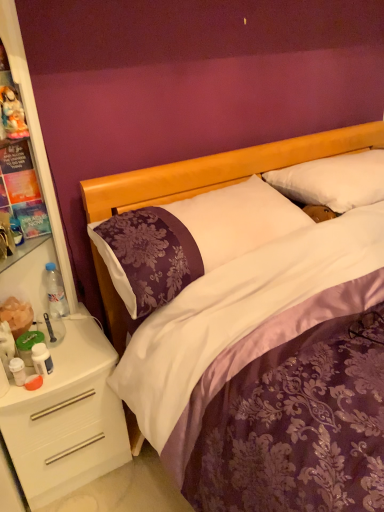
This screenshot has height=512, width=384. What do you see at coordinates (55, 292) in the screenshot?
I see `clear plastic bottle at left` at bounding box center [55, 292].

Measure the distance between clear plastic bottle at left and camera.

A distance of 1.51 meters exists between clear plastic bottle at left and camera.

Image resolution: width=384 pixels, height=512 pixels. What do you see at coordinates (58, 350) in the screenshot? I see `white plastic dresser at left` at bounding box center [58, 350].

In order to face white plastic drawer at lower left, should I rotate leftwards or rightwards?

Rotate left and turn 17.622 degrees.

Identify the location of clear plastic bottle at left. The height and width of the screenshot is (512, 384). (55, 292).

How distant is purple satin pillow at center, marked as the 2th pillow in a right-to-left arrangement, from white soft pillow at upper center, marked as the first pillow in a right-to-left arrangement?

They are 14.93 inches apart.

Image resolution: width=384 pixels, height=512 pixels. What are the coordinates of `pillow above the purple satin pillow at center, marked as the 2th pillow in a right-to-left arrangement (from a real-world perspective)` in the screenshot? It's located at click(333, 181).

What's the angular difference between purple satin pillow at center, marked as the 2th pillow in a right-to-left arrangement, and white soft pillow at upper center, marked as the first pillow in a right-to-left arrangement,'s facing directions?

The facing directions of purple satin pillow at center, marked as the 2th pillow in a right-to-left arrangement, and white soft pillow at upper center, marked as the first pillow in a right-to-left arrangement, are 0.355 degrees apart.

From the image's perspective, is purple satin pillow at center, marked as the 2th pillow in a right-to-left arrangement, under white soft pillow at upper center, which is counted as the second pillow, starting from the left?

Indeed, from the image's perspective, purple satin pillow at center, marked as the 2th pillow in a right-to-left arrangement, is shown beneath white soft pillow at upper center, which is counted as the second pillow, starting from the left.

From a real-world perspective, is clear plastic bottle at left beneath matte plastic figurine at upper left?

Yes, from a real-world perspective, clear plastic bottle at left is under matte plastic figurine at upper left.

Is clear plastic bottle at left oriented away from matte plastic figurine at upper left?

No.

Can you confirm if clear plastic bottle at left is positioned to the right of matte plastic figurine at upper left?

Correct, you'll find clear plastic bottle at left to the right of matte plastic figurine at upper left.

Can you confirm if clear plastic bottle at left is thinner than matte plastic figurine at upper left?

No, clear plastic bottle at left is not thinner than matte plastic figurine at upper left.

Based on the photo, from a real-world perspective, relative to white plastic drawer at lower left, is clear plastic bottle at left vertically above or below?

clear plastic bottle at left is situated higher than white plastic drawer at lower left in the real world.

Between clear plastic bottle at left and white plastic drawer at lower left, which one has smaller size?

With smaller size is clear plastic bottle at left.

Find the location of a particular element. This screenshot has width=384, height=512. bottle behind the white plastic drawer at lower left is located at coordinates (55, 292).

Is the depth of clear plastic bottle at left less than that of white plastic drawer at lower left?

No, clear plastic bottle at left is further to the viewer.

From the image's perspective, would you say matte plastic figurine at upper left is positioned over purple satin pillow at center, marked as the 2th pillow in a right-to-left arrangement?

Correct, matte plastic figurine at upper left appears higher than purple satin pillow at center, marked as the 2th pillow in a right-to-left arrangement, in the image.

Can you confirm if matte plastic figurine at upper left is wider than purple satin pillow at center, marked as the 2th pillow in a right-to-left arrangement?

No.

How distant is matte plastic figurine at upper left from purple satin pillow at center, marked as the 2th pillow in a right-to-left arrangement?

They are 23.87 inches apart.

From the picture: How different are the orientations of matte plastic figurine at upper left and purple satin pillow at center, positioned as the 1th pillow in left-to-right order, in degrees?

1.63 degrees.

Consider the image. Which object is further away from the camera taking this photo, white plastic dresser at left or white soft pillow at upper center, marked as the first pillow in a right-to-left arrangement?

Positioned behind is white soft pillow at upper center, marked as the first pillow in a right-to-left arrangement.

Is white plastic dresser at left turned away from white soft pillow at upper center, marked as the first pillow in a right-to-left arrangement?

No, white plastic dresser at left is not facing the opposite direction of white soft pillow at upper center, marked as the first pillow in a right-to-left arrangement.

How many degrees apart are the facing directions of white plastic dresser at left and white soft pillow at upper center, which is counted as the second pillow, starting from the left?

2.51 degrees separate the facing orientations of white plastic dresser at left and white soft pillow at upper center, which is counted as the second pillow, starting from the left.

Is white plastic dresser at left not close to white soft pillow at upper center, marked as the first pillow in a right-to-left arrangement?

Yes, white plastic dresser at left and white soft pillow at upper center, marked as the first pillow in a right-to-left arrangement, are located far from each other.

Is purple satin pillow at center, positioned as the 1th pillow in left-to-right order, aimed at clear plastic bottle at left?

No.

The height and width of the screenshot is (512, 384). Find the location of `the 2nd pillow in front of the clear plastic bottle at left, starting your count from the anchor`. the 2nd pillow in front of the clear plastic bottle at left, starting your count from the anchor is located at coordinates (193, 237).

Which is in front, point (147, 313) or point (59, 305)?

The point (147, 313) is closer to the camera.

Considering the sizes of objects purple satin pillow at center, positioned as the 1th pillow in left-to-right order, and matte plastic figurine at upper left in the image provided, who is smaller, purple satin pillow at center, positioned as the 1th pillow in left-to-right order, or matte plastic figurine at upper left?

With smaller size is matte plastic figurine at upper left.

From the image's perspective, which object appears higher, purple satin pillow at center, marked as the 2th pillow in a right-to-left arrangement, or matte plastic figurine at upper left?

matte plastic figurine at upper left is shown above in the image.

Does point (182, 281) appear closer or farther from the camera than point (20, 108)?

Point (182, 281) is closer to the camera than point (20, 108).

Locate an element on the screen. The image size is (384, 512). pillow that is behind the purple satin pillow at center, positioned as the 1th pillow in left-to-right order is located at coordinates (333, 181).

I want to click on toy that is in front of the clear plastic bottle at left, so click(12, 113).

When comparing their distances from white soft pillow at upper center, which is counted as the second pillow, starting from the left, does purple satin pillow at center, marked as the 2th pillow in a right-to-left arrangement, or white plastic dresser at left seem closer?

purple satin pillow at center, marked as the 2th pillow in a right-to-left arrangement, lies closer to white soft pillow at upper center, which is counted as the second pillow, starting from the left, than the other object.

Based on their spatial positions, is purple satin pillow at center, positioned as the 1th pillow in left-to-right order, or white soft pillow at upper center, marked as the first pillow in a right-to-left arrangement, further from matte plastic figurine at upper left?

white soft pillow at upper center, marked as the first pillow in a right-to-left arrangement.

Considering their positions, is clear plastic bottle at left positioned closer to matte plastic figurine at upper left than white soft pillow at upper center, marked as the first pillow in a right-to-left arrangement?

clear plastic bottle at left is positioned closer to the anchor matte plastic figurine at upper left.

Which object lies nearer to the anchor point white plastic drawer at lower left, clear plastic bottle at left or white soft pillow at upper center, marked as the first pillow in a right-to-left arrangement?

clear plastic bottle at left is closer to white plastic drawer at lower left.

Estimate the real-world distances between objects in this image. Which object is closer to clear plastic bottle at left, white soft pillow at upper center, marked as the first pillow in a right-to-left arrangement, or white plastic dresser at left?

white plastic dresser at left is closer to clear plastic bottle at left.

Based on their spatial positions, is matte plastic figurine at upper left or white plastic dresser at left closer to white plastic drawer at lower left?

white plastic dresser at left is positioned closer to the anchor white plastic drawer at lower left.

Looking at the image, which one is located further to white soft pillow at upper center, which is counted as the second pillow, starting from the left, white plastic dresser at left or purple satin pillow at center, positioned as the 1th pillow in left-to-right order?

Based on the image, white plastic dresser at left appears to be further to white soft pillow at upper center, which is counted as the second pillow, starting from the left.

Estimate the real-world distances between objects in this image. Which object is further from purple satin pillow at center, positioned as the 1th pillow in left-to-right order, matte plastic figurine at upper left or white soft pillow at upper center, marked as the first pillow in a right-to-left arrangement?

matte plastic figurine at upper left lies further to purple satin pillow at center, positioned as the 1th pillow in left-to-right order, than the other object.

Find the location of `pillow between white plastic dresser at left and white plastic drawer at lower left vertically`. pillow between white plastic dresser at left and white plastic drawer at lower left vertically is located at coordinates (193, 237).

Identify the location of bottle between matte plastic figurine at upper left and white plastic drawer at lower left in the vertical direction. (55, 292).

Locate an element on the screen. drawer between white plastic dresser at left and white soft pillow at upper center, which is counted as the second pillow, starting from the left is located at coordinates point(63,435).

This screenshot has height=512, width=384. What are the coordinates of `toy between white plastic dresser at left and clear plastic bottle at left from front to back` in the screenshot? It's located at (12, 113).